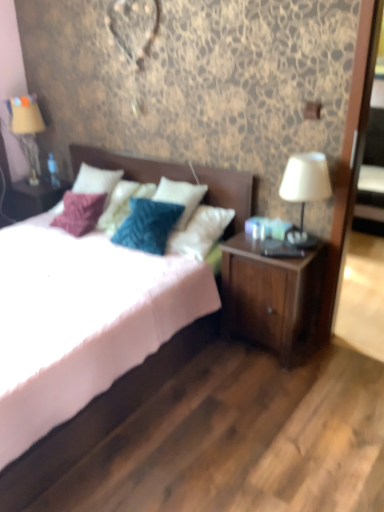
Locate an element on the screen. The height and width of the screenshot is (512, 384). free space on the front side of wooden nightstand at lower right is located at coordinates (272, 383).